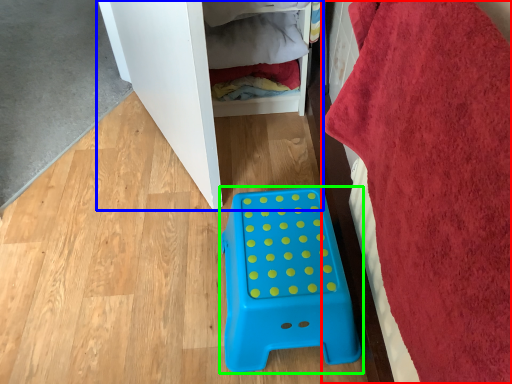
Question: Estimate the real-world distances between objects in this image. Which object is closer to bath towel (highlighted by a red box), furniture (highlighted by a blue box) or furniture (highlighted by a green box)?

Choices:
 (A) furniture
 (B) furniture

Answer: (B)